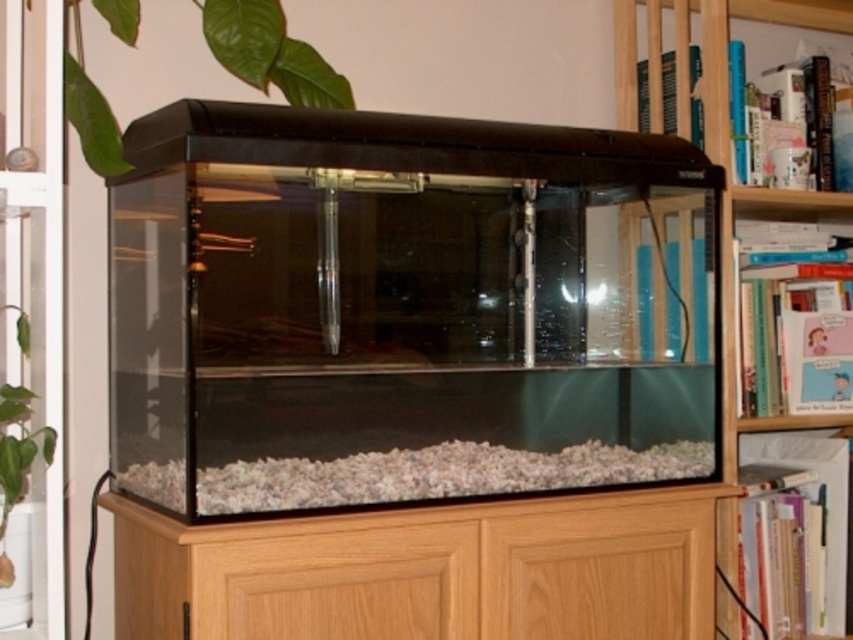
Question: Is white gravel at bottom bigger than wooden bookshelf at upper right?

Choices:
 (A) yes
 (B) no

Answer: (B)

Question: Which of the following is the farthest from the observer?

Choices:
 (A) (689, 472)
 (B) (653, 104)

Answer: (B)

Question: Is white gravel at bottom smaller than wooden bookshelf at upper right?

Choices:
 (A) yes
 (B) no

Answer: (A)

Question: Among these points, which one is farthest from the camera?

Choices:
 (A) (445, 442)
 (B) (729, 216)

Answer: (B)

Question: Does white gravel at bottom lie in front of wooden bookshelf at upper right?

Choices:
 (A) yes
 (B) no

Answer: (A)